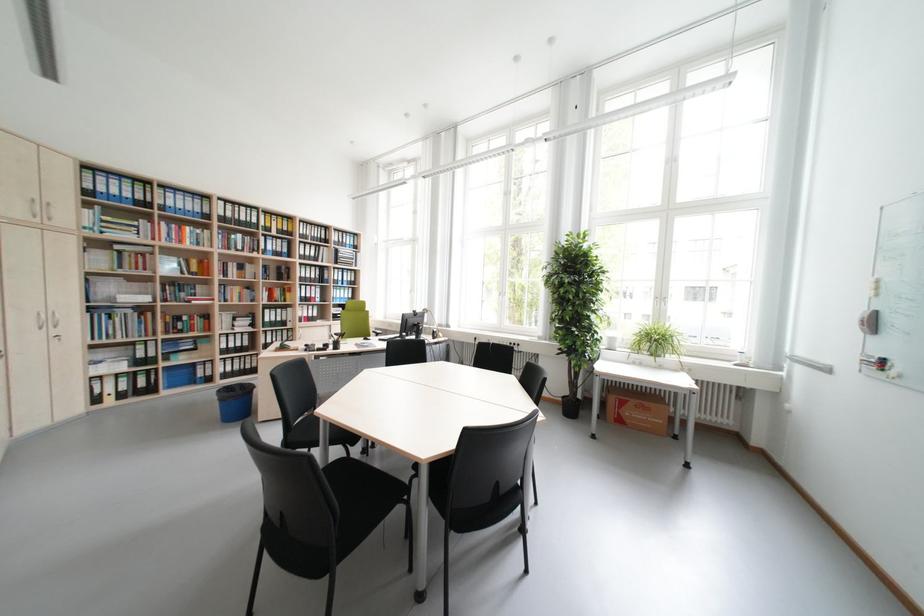
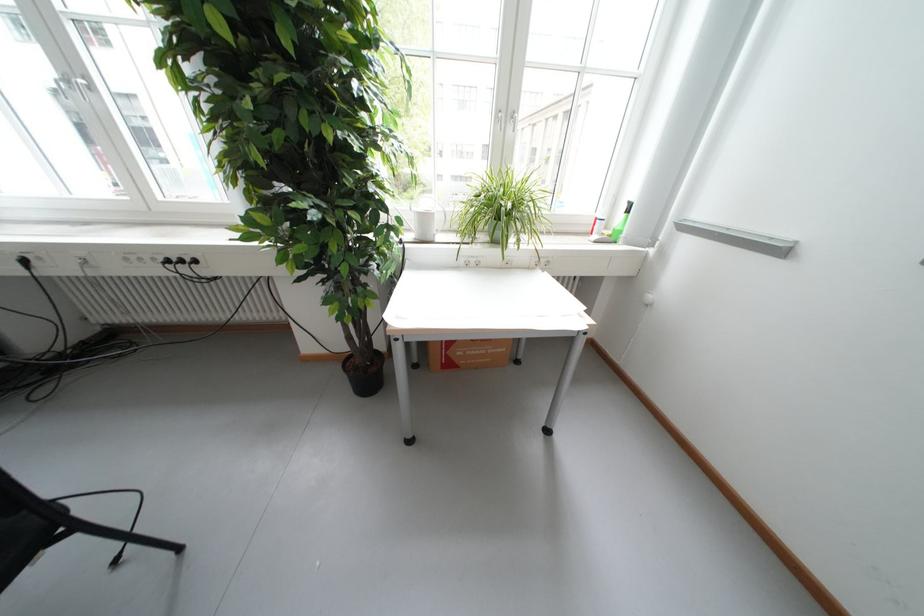
Find the pixel in the second image that matches the point at 622,341 in the first image.

(435, 220)